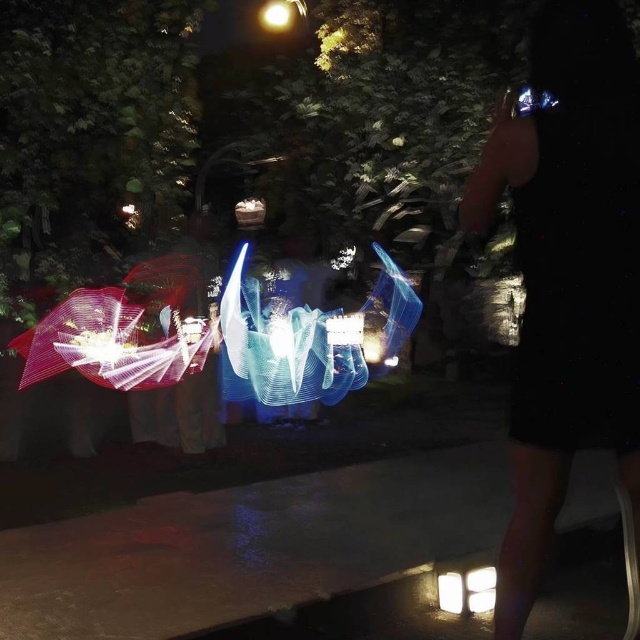
Does metallic silver bracelet at upper right have a larger size compared to white glossy light at lower center?

Yes, metallic silver bracelet at upper right is bigger than white glossy light at lower center.

Which is behind, point (570, 372) or point (444, 579)?

Positioned behind is point (444, 579).

Find the location of a particular element. metallic silver bracelet at upper right is located at coordinates (566, 275).

Who is taller, white glossy light at lower center or white glossy square at lower right?

white glossy light at lower center

Does white glossy light at lower center have a greater width compared to white glossy square at lower right?

Incorrect, white glossy light at lower center's width does not surpass white glossy square at lower right's.

Identify the location of white glossy light at lower center. (451, 593).

The width and height of the screenshot is (640, 640). Find the location of `white glossy light at lower center`. white glossy light at lower center is located at coordinates (451, 593).

Which is in front, point (516, 451) or point (266, 8)?

Point (516, 451) is more forward.

Can you confirm if metallic silver bracelet at upper right is positioned to the left of matte white light at upper center?

In fact, metallic silver bracelet at upper right is to the right of matte white light at upper center.

Who is more distant from viewer, (563,496) or (266,12)?

Positioned behind is point (266,12).

Where is `metallic silver bracelet at upper right`? metallic silver bracelet at upper right is located at coordinates (566, 275).